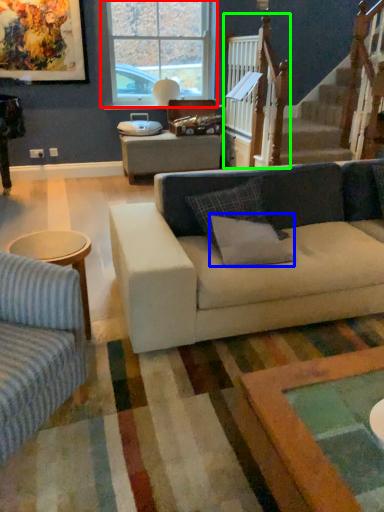
Question: Based on their relative distances, which object is farther from window (highlighted by a red box)? Choose from pillow (highlighted by a blue box) and rail (highlighted by a green box).

Choices:
 (A) pillow
 (B) rail

Answer: (A)